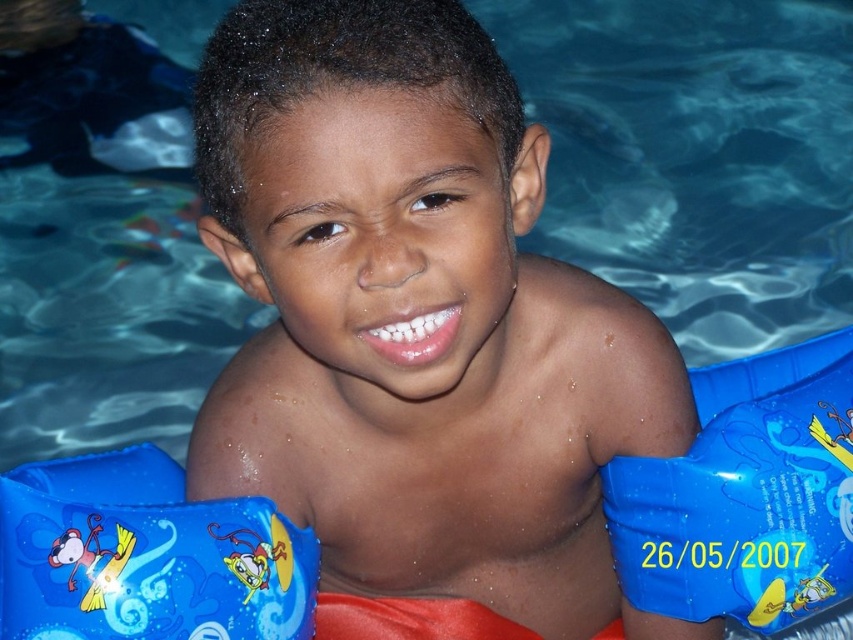
Question: Which object appears closest to the camera in this image?

Choices:
 (A) blue inflatable arm band at right
 (B) blue rubber arm bands at center
 (C) blue inflatable arm bands at lower left

Answer: (B)

Question: Is blue inflatable arm band at right to the right of blue inflatable arm bands at lower left from the viewer's perspective?

Choices:
 (A) no
 (B) yes

Answer: (B)

Question: Does blue rubber arm bands at center have a larger size compared to blue inflatable arm bands at lower left?

Choices:
 (A) no
 (B) yes

Answer: (B)

Question: Which object appears closest to the camera in this image?

Choices:
 (A) blue inflatable arm bands at lower left
 (B) blue inflatable arm band at right

Answer: (A)

Question: Considering the relative positions of blue inflatable arm band at right and blue inflatable arm bands at lower left in the image provided, where is blue inflatable arm band at right located with respect to blue inflatable arm bands at lower left?

Choices:
 (A) left
 (B) right

Answer: (B)

Question: Estimate the real-world distances between objects in this image. Which object is closer to the blue inflatable arm bands at lower left?

Choices:
 (A) blue inflatable arm band at right
 (B) blue rubber arm bands at center

Answer: (B)